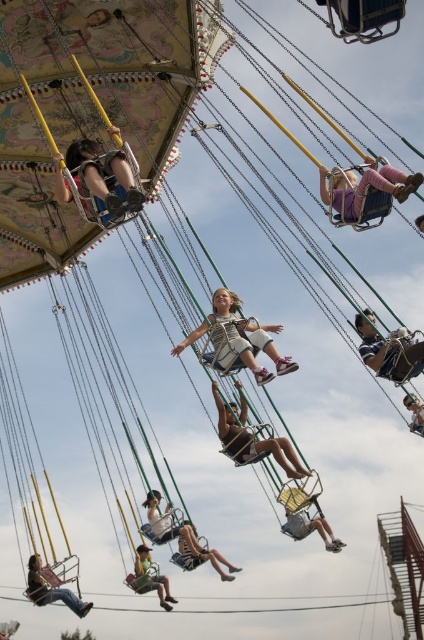
At what (x,y) coordinates should I click in order to perform the action: click on pink fabric swing at upper center. Please return your answer as a coordinate pair (x, y). This screenshot has width=424, height=640. Looking at the image, I should click on (363, 186).

Who is positioned more to the right, pink fabric swing at upper center or matte plastic swing at center?

Positioned to the right is pink fabric swing at upper center.

Which is in front, point (413, 192) or point (251, 442)?

Point (413, 192)

The image size is (424, 640). Find the location of `pink fabric swing at upper center`. pink fabric swing at upper center is located at coordinates (363, 186).

Does light blue denim shorts at center have a larger size compared to green fabric swing at lower left?

Correct, light blue denim shorts at center is larger in size than green fabric swing at lower left.

Who is lower down, light blue denim shorts at center or green fabric swing at lower left?

green fabric swing at lower left

Is point (220, 348) farther from camera compared to point (136, 579)?

No, it is in front of (136, 579).

The height and width of the screenshot is (640, 424). Find the location of `light blue denim shorts at center`. light blue denim shorts at center is located at coordinates (237, 339).

Is point (334, 196) farther from viewer compared to point (186, 538)?

No.

Which is below, pink fabric swing at upper center or denim shorts at center?

Positioned lower is denim shorts at center.

Where is `pink fabric swing at upper center`? This screenshot has width=424, height=640. pink fabric swing at upper center is located at coordinates (363, 186).